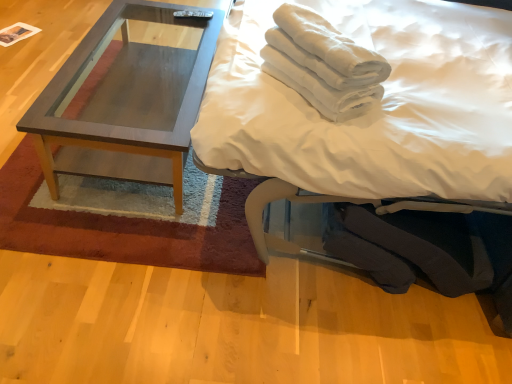
At what (x,y) coordinates should I click in order to perform the action: click on white soft bed at upper right. Please return your answer as a coordinate pair (x, y). Looking at the image, I should click on (370, 111).

The width and height of the screenshot is (512, 384). I want to click on white cotton towels at upper right, so click(323, 64).

Image resolution: width=512 pixels, height=384 pixels. Find the location of `matte wood coffee table at left`. matte wood coffee table at left is located at coordinates (126, 102).

Is matte wood coffee table at left in front of or behind white cotton towels at upper right in the image?

Visually, matte wood coffee table at left is located behind white cotton towels at upper right.

Between matte wood coffee table at left and white cotton towels at upper right, which one has more height?

matte wood coffee table at left.

Consider the image. Which object is positioned more to the right, matte wood coffee table at left or white cotton towels at upper right?

white cotton towels at upper right is more to the right.

Where is `material on the right of matte wood coffee table at left`? material on the right of matte wood coffee table at left is located at coordinates coord(323,64).

Based on the photo, is white soft bed at upper right next to wooden coffee table at center?

No, white soft bed at upper right is not touching wooden coffee table at center.

From the image's perspective, is white soft bed at upper right under wooden coffee table at center?

No, from the image's perspective, white soft bed at upper right is not beneath wooden coffee table at center.

Consider the image. Is white soft bed at upper right positioned with its back to wooden coffee table at center?

No, white soft bed at upper right is not facing away from wooden coffee table at center.

Which is behind, white soft bed at upper right or wooden coffee table at center?

wooden coffee table at center is behind.

Is white cotton towels at upper right smaller than wooden coffee table at center?

Indeed, white cotton towels at upper right has a smaller size compared to wooden coffee table at center.

Would you say white cotton towels at upper right is a long distance from wooden coffee table at center?

No, white cotton towels at upper right is not far away from wooden coffee table at center.

Considering the sizes of objects white cotton towels at upper right and wooden coffee table at center in the image provided, who is shorter, white cotton towels at upper right or wooden coffee table at center?

With less height is wooden coffee table at center.

From the image's perspective, which is above, white cotton towels at upper right or wooden coffee table at center?

From the image's view, white cotton towels at upper right is above.

From a real-world perspective, which is physically above, wooden coffee table at center or white soft bed at upper right?

From a 3D spatial view, white soft bed at upper right is above.

The image size is (512, 384). I want to click on mat located on the left of white soft bed at upper right, so click(123, 228).

Is wooden coffee table at center facing away from white soft bed at upper right?

No, wooden coffee table at center is not facing away from white soft bed at upper right.

Consider the image. From a real-world perspective, is white cotton towels at upper right physically located above or below white soft bed at upper right?

From a real-world perspective, white cotton towels at upper right is physically above white soft bed at upper right.

From the image's perspective, between white cotton towels at upper right and white soft bed at upper right, who is located below?

white soft bed at upper right, from the image's perspective.

Considering the relative sizes of white cotton towels at upper right and white soft bed at upper right in the image provided, is white cotton towels at upper right wider than white soft bed at upper right?

Incorrect, the width of white cotton towels at upper right does not surpass that of white soft bed at upper right.

Is white soft bed at upper right completely or partially inside white cotton towels at upper right?

No, white soft bed at upper right is located outside of white cotton towels at upper right.

The width and height of the screenshot is (512, 384). Find the location of `material above the matte wood coffee table at left (from a real-world perspective)`. material above the matte wood coffee table at left (from a real-world perspective) is located at coordinates click(x=323, y=64).

Is point (333, 70) positioned after point (177, 64)?

No.

Between white cotton towels at upper right and matte wood coffee table at left, which one has less height?

With less height is white cotton towels at upper right.

Which of these two, white cotton towels at upper right or matte wood coffee table at left, is bigger?

With larger size is matte wood coffee table at left.

Does point (129, 53) appear closer or farther from the camera than point (113, 253)?

Point (129, 53) is positioned farther from the camera compared to point (113, 253).

Looking at this image, considering the relative positions of matte wood coffee table at left and wooden coffee table at center in the image provided, is matte wood coffee table at left to the left of wooden coffee table at center from the viewer's perspective?

Correct, you'll find matte wood coffee table at left to the left of wooden coffee table at center.

Image resolution: width=512 pixels, height=384 pixels. What are the coordinates of `coffee table that is in front of the wooden coffee table at center` in the screenshot? It's located at (126, 102).

Is matte wood coffee table at left inside or outside of wooden coffee table at center?

matte wood coffee table at left is not inside wooden coffee table at center, it's outside.

This screenshot has width=512, height=384. I want to click on coffee table below the white cotton towels at upper right (from a real-world perspective), so click(126, 102).

Image resolution: width=512 pixels, height=384 pixels. Find the location of `bed above the wooden coffee table at center (from the image's perspective)`. bed above the wooden coffee table at center (from the image's perspective) is located at coordinates (370, 111).

Estimate the real-world distances between objects in this image. Which object is further from wooden coffee table at center, white soft bed at upper right or matte wood coffee table at left?

white soft bed at upper right is positioned further to the anchor wooden coffee table at center.

From the image, which object appears to be farther from wooden coffee table at center, white cotton towels at upper right or white soft bed at upper right?

white cotton towels at upper right is positioned further to the anchor wooden coffee table at center.

Looking at the image, which one is located closer to matte wood coffee table at left, wooden coffee table at center or white soft bed at upper right?

wooden coffee table at center is closer to matte wood coffee table at left.

Looking at this image, which object lies nearer to the anchor point white soft bed at upper right, wooden coffee table at center or white cotton towels at upper right?

Among the two, white cotton towels at upper right is located nearer to white soft bed at upper right.

From the image, which object appears to be nearer to white soft bed at upper right, matte wood coffee table at left or wooden coffee table at center?

matte wood coffee table at left is closer to white soft bed at upper right.

When comparing their distances from white cotton towels at upper right, does wooden coffee table at center or white soft bed at upper right seem closer?

Based on the image, white soft bed at upper right appears to be nearer to white cotton towels at upper right.

When comparing their distances from white soft bed at upper right, does matte wood coffee table at left or white cotton towels at upper right seem closer?

Among the two, white cotton towels at upper right is located nearer to white soft bed at upper right.

Looking at the image, which one is located closer to matte wood coffee table at left, white soft bed at upper right or white cotton towels at upper right?

Among the two, white cotton towels at upper right is located nearer to matte wood coffee table at left.

Find the location of a particular element. material between wooden coffee table at center and white soft bed at upper right from left to right is located at coordinates (323, 64).

Where is `material between matte wood coffee table at left and white soft bed at upper right from left to right`? material between matte wood coffee table at left and white soft bed at upper right from left to right is located at coordinates (323, 64).

In order to click on mat situated between matte wood coffee table at left and white cotton towels at upper right from left to right in this screenshot , I will do `click(123, 228)`.

The width and height of the screenshot is (512, 384). I want to click on mat between matte wood coffee table at left and white soft bed at upper right in the horizontal direction, so click(123, 228).